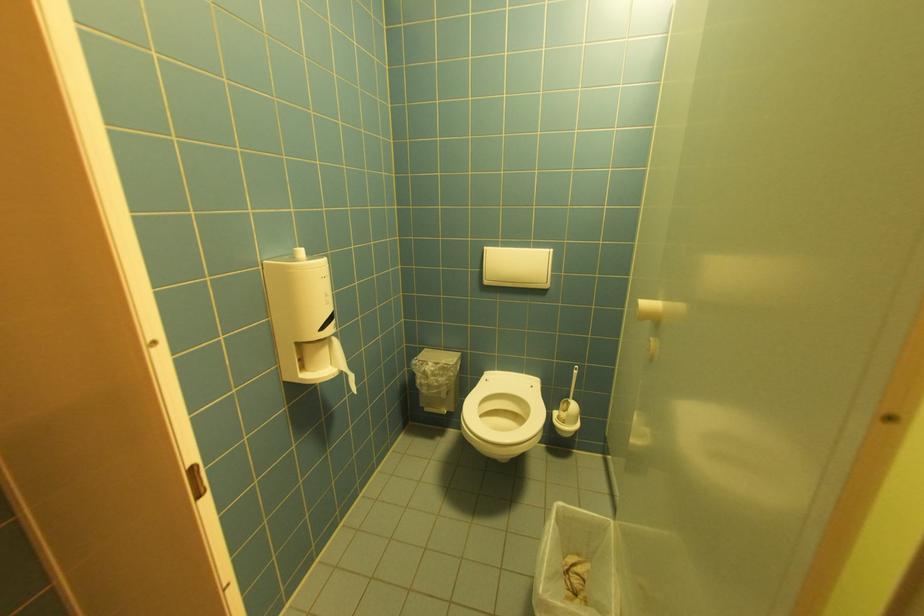
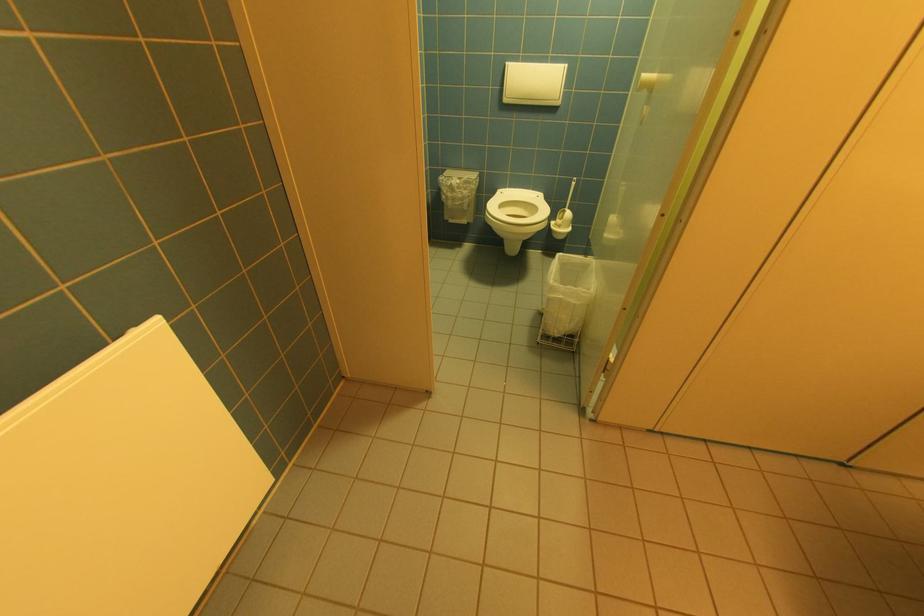
Where in the second image is the point corresponding to point (504, 371) from the first image?

(515, 188)